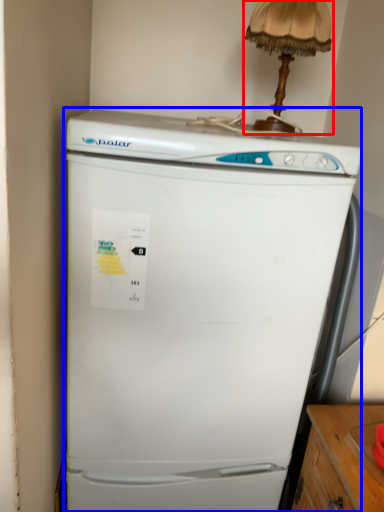
Question: Which point is closer to the camera, table lamp (highlighted by a red box) or refrigerator (highlighted by a blue box)?

Choices:
 (A) table lamp
 (B) refrigerator

Answer: (B)